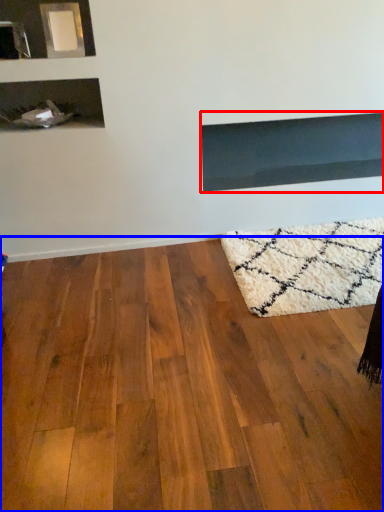
Question: Among these objects, which one is farthest to the camera, fireplace (highlighted by a red box) or hardwood (highlighted by a blue box)?

Choices:
 (A) fireplace
 (B) hardwood

Answer: (A)